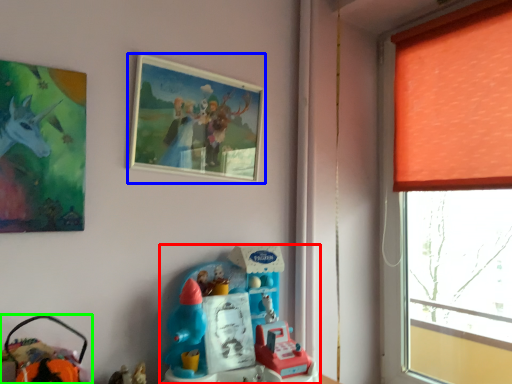
Question: Based on their relative distances, which object is farther from toy (highlighted by a red box)? Choose from picture frame (highlighted by a blue box) and toy (highlighted by a green box).

Choices:
 (A) picture frame
 (B) toy

Answer: (A)